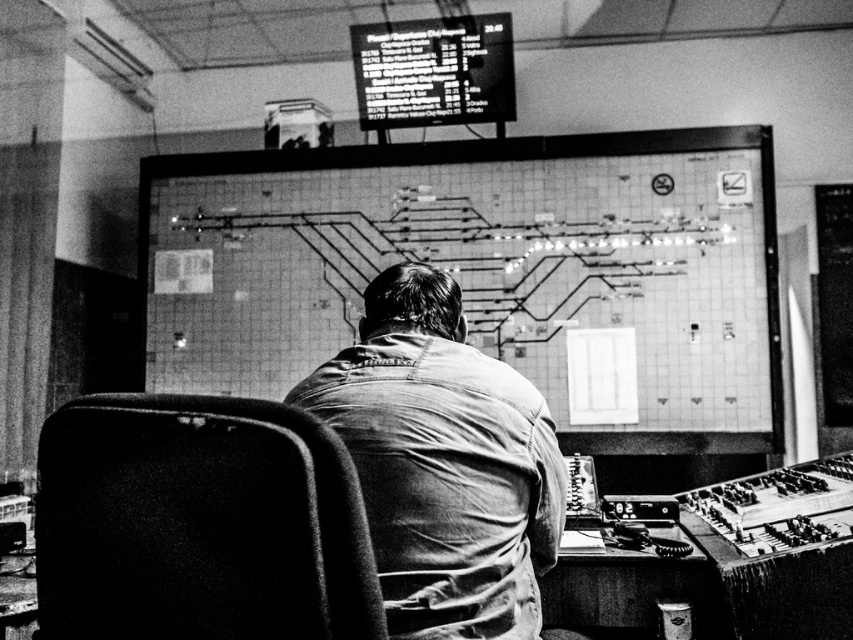
You are an inspector checking the control room. You need to sit in the velvety black chair at center to monitor the black plastic screen at upper center. Can you comfortably fit in the chair while facing the screen?

The velvety black chair at center has a smaller width than the black plastic screen at upper center. Since the chair is narrower, you can comfortably fit in the chair while facing the screen.

You are an observer looking at the control room scene. You notice the denim shirt at center and the black plastic screen at upper center. Which object is taller?

The denim shirt at center is taller than the black plastic screen at upper center according to the description.